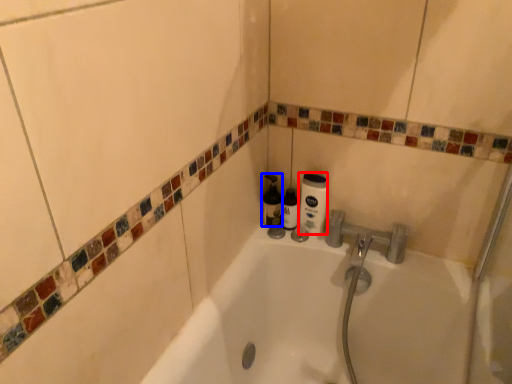
Question: Which of the following is the closest to the observer, cleaning product (highlighted by a red box) or bottle (highlighted by a blue box)?

Choices:
 (A) cleaning product
 (B) bottle

Answer: (A)